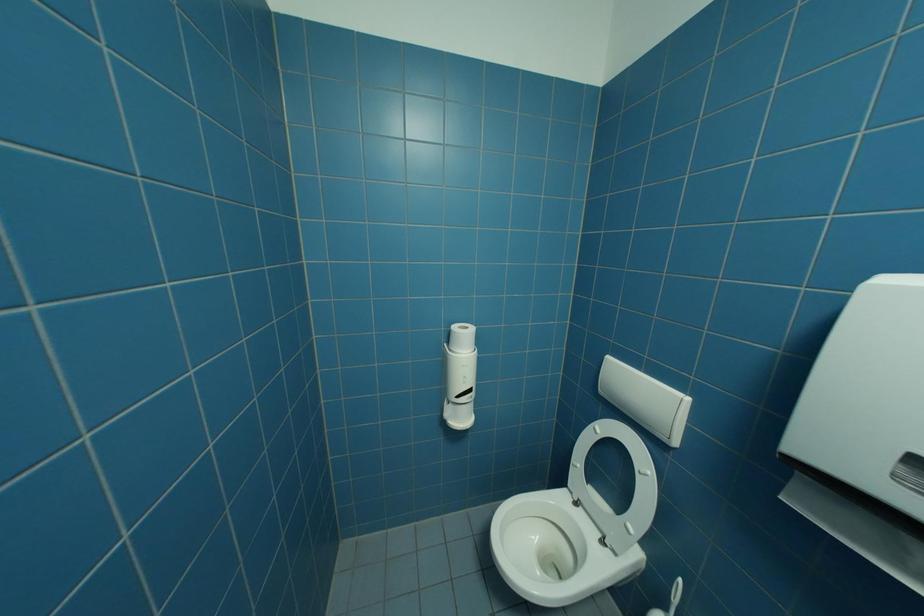
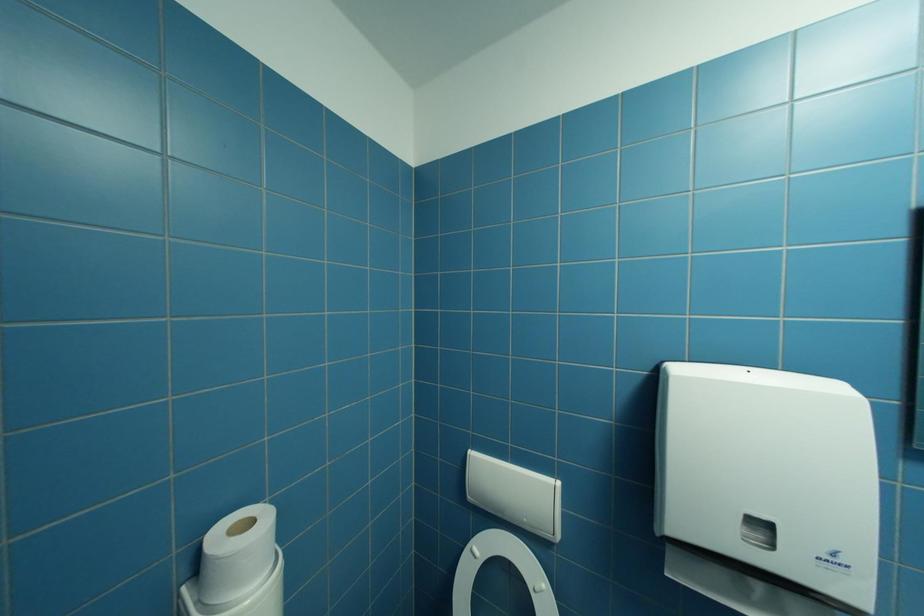
Question: Based on the continuous images, in which direction is the camera rotating? Reply with the corresponding letter.

Choices:
 (A) Left
 (B) Right
 (C) Up
 (D) Down

Answer: (B)